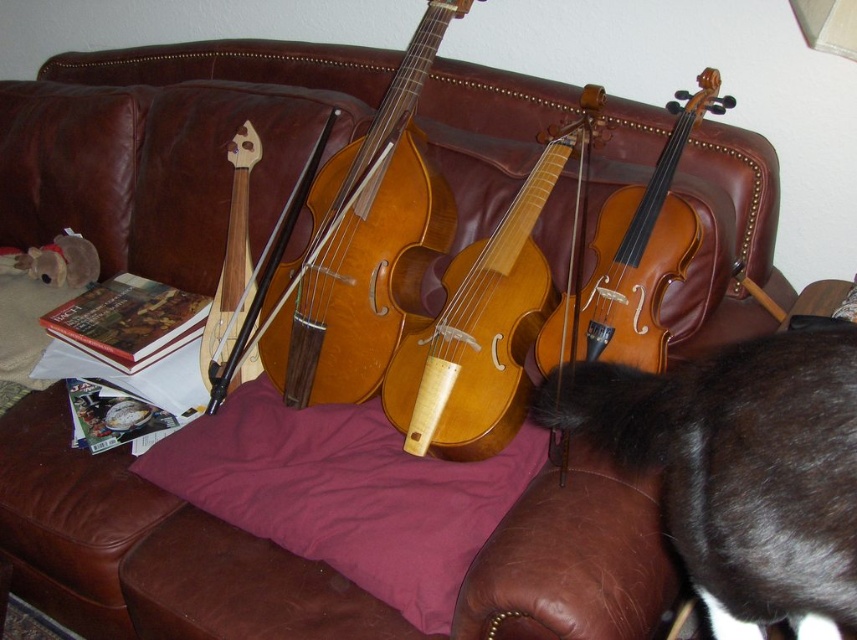
Question: Which object is the closest to the light brown wood violin at center?

Choices:
 (A) wooden violin at center
 (B) shiny brown violin at center
 (C) purple cotton pillow at center

Answer: (B)

Question: Is light brown wood violin at center to the right of shiny brown violin at center from the viewer's perspective?

Choices:
 (A) yes
 (B) no

Answer: (B)

Question: Which of the following is the closest to the observer?

Choices:
 (A) purple cotton pillow at center
 (B) wooden violin at center
 (C) light brown wood cello at center

Answer: (A)

Question: Which point is farther to the camera?

Choices:
 (A) (381, 362)
 (B) (282, 216)
 (C) (385, 397)
 (D) (652, 289)

Answer: (B)

Question: In this image, where is light brown wood cello at center located relative to shiny brown violin at center?

Choices:
 (A) right
 (B) left

Answer: (B)

Question: Is shiny brown violin at center wider than wooden violin at center?

Choices:
 (A) no
 (B) yes

Answer: (B)